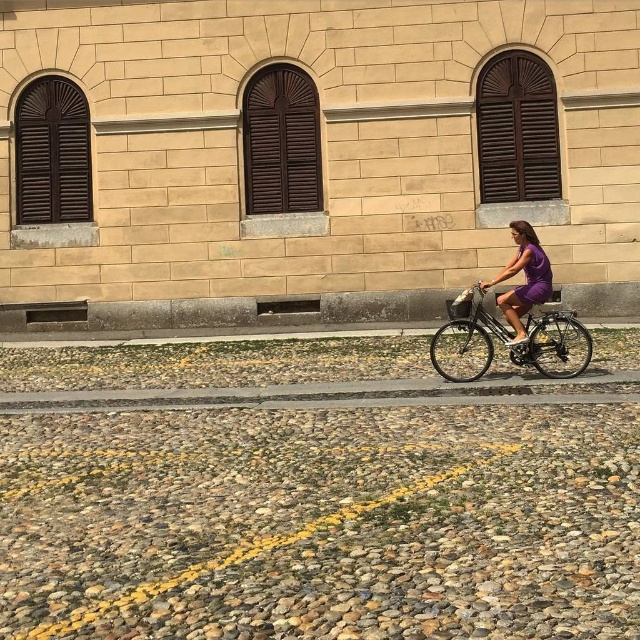
Which is behind, point (588, 360) or point (522, 240)?

The point (522, 240) is more distant.

What do you see at coordinates (509, 339) in the screenshot? The height and width of the screenshot is (640, 640). I see `shiny metallic bicycle at right` at bounding box center [509, 339].

Between point (538, 340) and point (502, 307), which one is positioned in front?

Point (502, 307)

The width and height of the screenshot is (640, 640). In order to click on shiny metallic bicycle at right in this screenshot , I will do `click(509, 339)`.